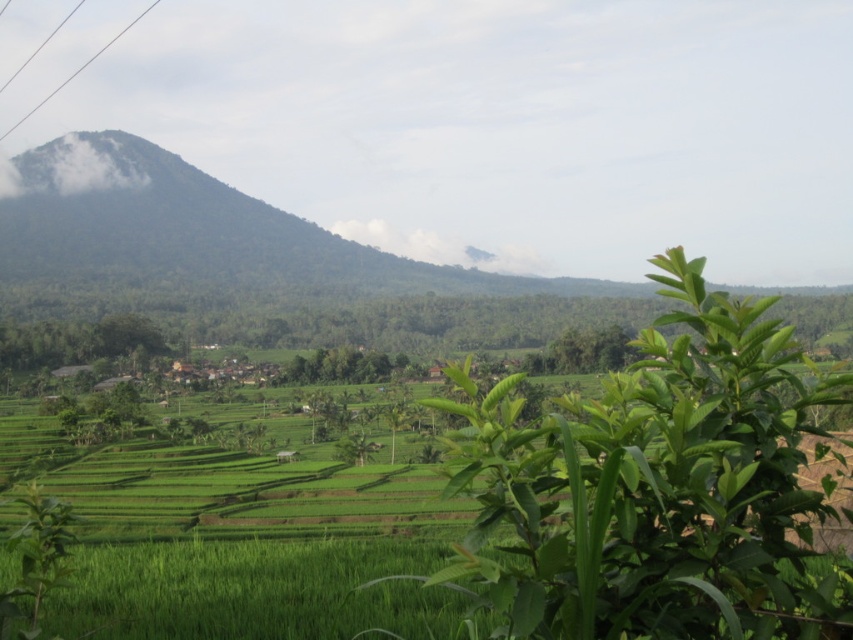
You are standing in the lush green landscape looking at the terraced rice fields. There are two points marked in the image. Which point is closer to you, point (553,536) or point (65,80)?

Point (553,536) is closer to the viewer than point (65,80).

From the picture: You are standing at the center of the image and want to locate the green leafy plant at center. According to the coordinates provided, in which direction should you look to find it?

The green leafy plant at center is located at coordinates (660, 490), which is slightly to the upper right from the exact center. So you should look towards the upper right direction from your current position at the center.

Consider the image. You are a hiker who wants to take a photo of the green leafy plant at center and the metallic wire at upper left. Which object should you focus on first if you want to capture both in one shot without adjusting your camera focus?

The metallic wire at upper left is farther away from the green leafy plant at center, so you should focus on the metallic wire at upper left first to ensure both are in focus.